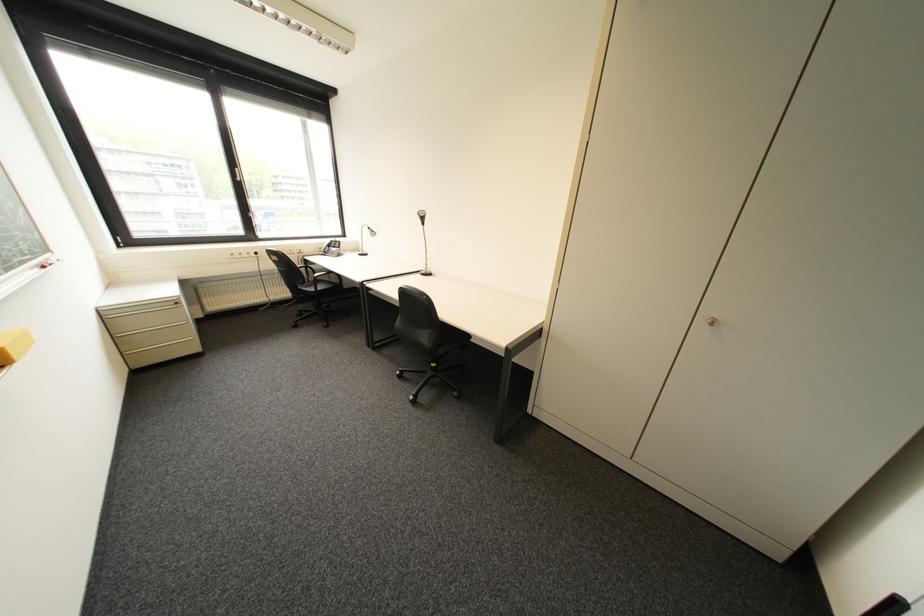
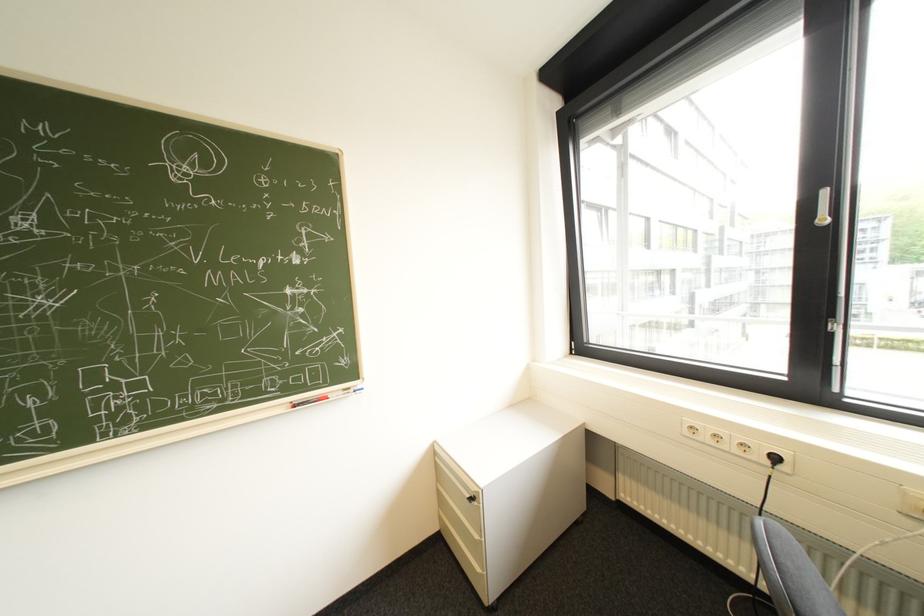
Locate, in the second image, the point that corresponds to point 247,169 in the first image.

(834, 193)